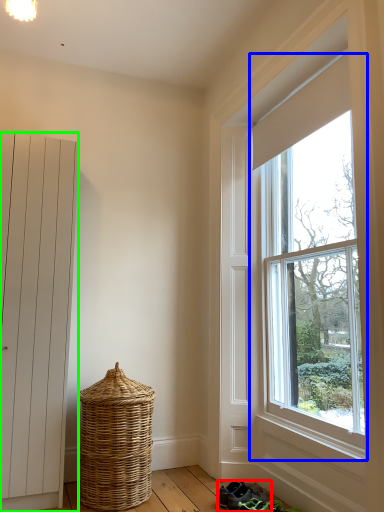
Question: Which object is the closest to the footwear (highlighted by a red box)? Choose among these: window (highlighted by a blue box) or door (highlighted by a green box).

Choices:
 (A) window
 (B) door

Answer: (A)